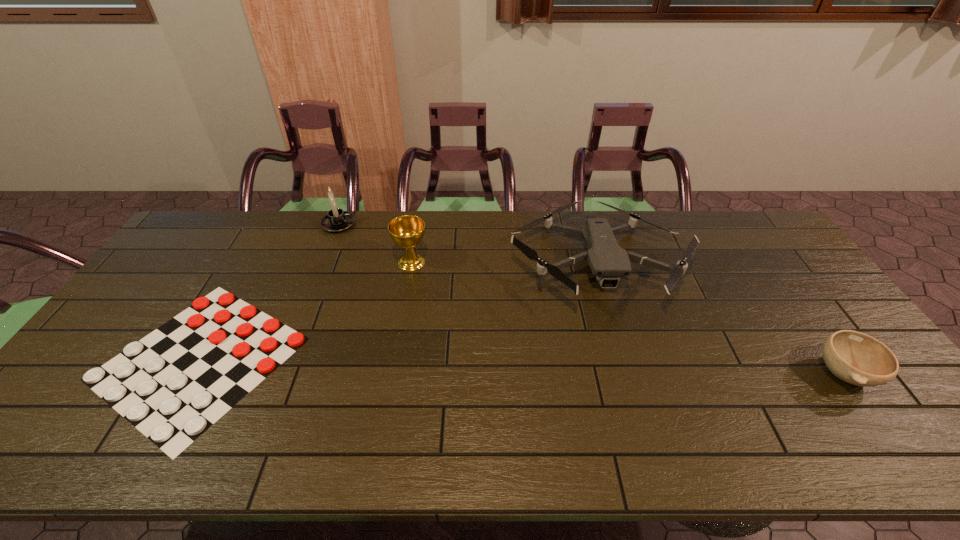
Identify the location of vacant position located 0.200m on the back of the second shortest object. (788, 295).

Find the location of `free region located on the right of the checkerboard`. free region located on the right of the checkerboard is located at coordinates (413, 359).

You are a GUI agent. You are given a task and a screenshot of the screen. Output one action in this format:
    pyautogui.click(x=<x>, y=<y>)
    Task: Click on the candle holder at the far edge
    Image resolution: width=960 pixels, height=540 pixels.
    Given the screenshot: What is the action you would take?
    pyautogui.click(x=336, y=220)

Identify the location of chalice that is at the far edge. This screenshot has height=540, width=960. (407, 231).

Image resolution: width=960 pixels, height=540 pixels. I want to click on drone located in the far edge section of the desktop, so click(x=607, y=260).

Locate an element on the screen. Image resolution: width=960 pixels, height=540 pixels. object at the near edge is located at coordinates (172, 385).

Locate an element on the screen. The height and width of the screenshot is (540, 960). object present at the left edge is located at coordinates (172, 385).

The image size is (960, 540). Find the location of `object that is positioned at the right edge`. object that is positioned at the right edge is located at coordinates (854, 357).

At what (x,y) coordinates should I click in order to perform the action: click on object that is at the near left corner. Please return your answer as a coordinate pair (x, y). Looking at the image, I should click on (172, 385).

In the image, there is a desktop. At what (x,y) coordinates should I click in order to perform the action: click on vacant space at the far edge. Please return your answer as a coordinate pair (x, y). Looking at the image, I should click on (248, 231).